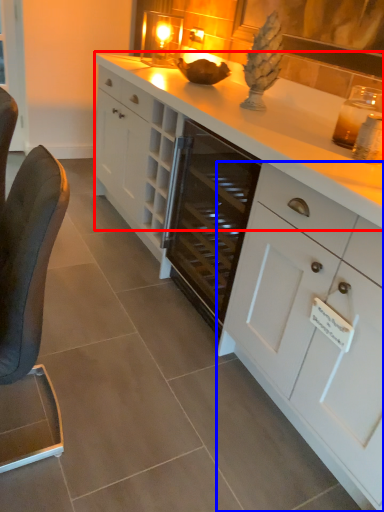
Question: Which object appears closest to the camera in this image, countertop (highlighted by a red box) or cabinetry (highlighted by a blue box)?

Choices:
 (A) countertop
 (B) cabinetry

Answer: (B)